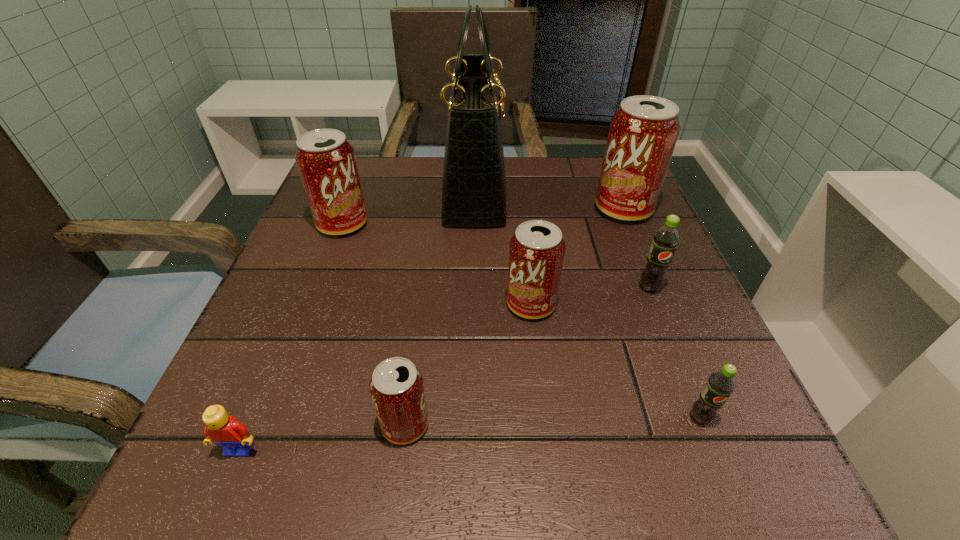
This screenshot has width=960, height=540. I want to click on vacant space that's between the leftmost red soda can and the smallest red soda can, so click(x=374, y=325).

Image resolution: width=960 pixels, height=540 pixels. I want to click on unoccupied position between the farther green soda and the Lego, so click(x=444, y=368).

The width and height of the screenshot is (960, 540). Find the location of `blank region between the biggest red soda can and the third biggest red soda can`. blank region between the biggest red soda can and the third biggest red soda can is located at coordinates 577,256.

At what (x,y) coordinates should I click in order to perform the action: click on free area in between the nearer green soda and the farther green soda. Please return your answer as a coordinate pair (x, y). Looking at the image, I should click on (675, 353).

Where is `object that is the closest to the nearest red soda can`? object that is the closest to the nearest red soda can is located at coordinates (225, 431).

Find the location of a particular element. The height and width of the screenshot is (540, 960). object that ranks as the second closest to the handbag is located at coordinates 536,253.

Image resolution: width=960 pixels, height=540 pixels. Identify the location of the closest soda to the yellow Lego. (397, 390).

The height and width of the screenshot is (540, 960). I want to click on soda that can be found as the fourth closest to the second smallest red soda can, so click(x=720, y=384).

Image resolution: width=960 pixels, height=540 pixels. Find the location of `red soda can that stands as the fourth closest to the tallest object`. red soda can that stands as the fourth closest to the tallest object is located at coordinates (397, 390).

You are a GUI agent. You are given a task and a screenshot of the screen. Output one action in this format:
    pyautogui.click(x=<x>, y=<y>)
    Task: Click on the red soda can that is the closest to the fifth shortest soda
    This screenshot has width=960, height=540.
    Given the screenshot: What is the action you would take?
    pyautogui.click(x=536, y=253)